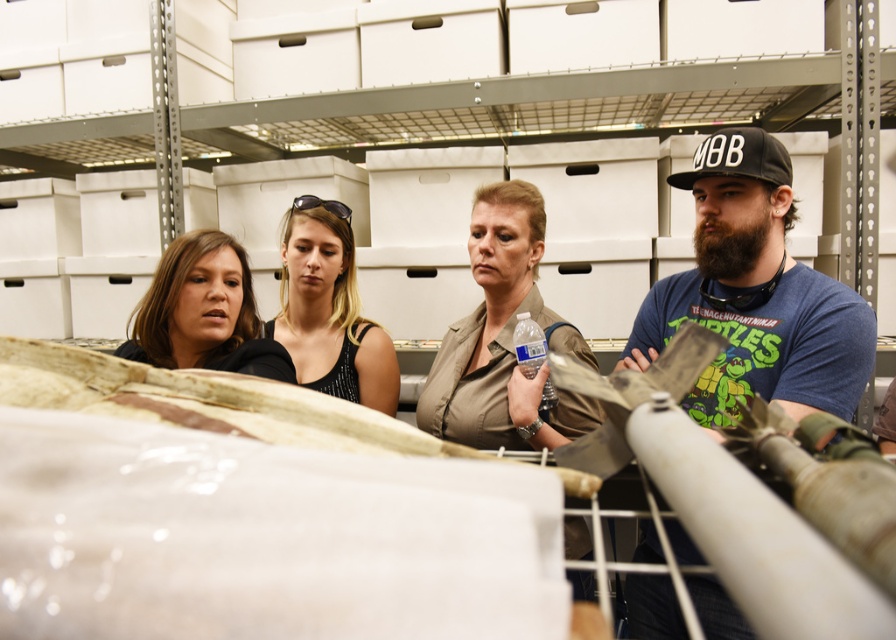
Question: Can you confirm if tan fabric shirt at center is positioned to the left of black matte baseball cap at right?

Choices:
 (A) no
 (B) yes

Answer: (B)

Question: Does black matte tank top at center have a greater width compared to black matte baseball cap at right?

Choices:
 (A) no
 (B) yes

Answer: (B)

Question: Does matte black hoodie at left have a smaller size compared to clear plastic bottle at center?

Choices:
 (A) yes
 (B) no

Answer: (B)

Question: Estimate the real-world distances between objects in this image. Which object is farther from the matte black hoodie at left?

Choices:
 (A) tan fabric shirt at center
 (B) black matte tank top at center
 (C) black matte baseball cap at right
 (D) clear plastic bottle at center

Answer: (C)

Question: Which object is the farthest from the black matte tank top at center?

Choices:
 (A) clear plastic bottle at center
 (B) black matte baseball cap at right
 (C) blue cotton t-shirt at right

Answer: (B)

Question: Which object is positioned farthest from the clear plastic bottle at center?

Choices:
 (A) matte black hoodie at left
 (B) black matte tank top at center

Answer: (A)